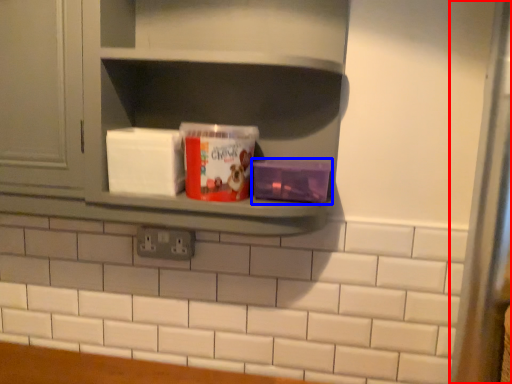
Question: Which point is further to the camera, glass door (highlighted by a red box) or carton (highlighted by a blue box)?

Choices:
 (A) glass door
 (B) carton

Answer: (B)